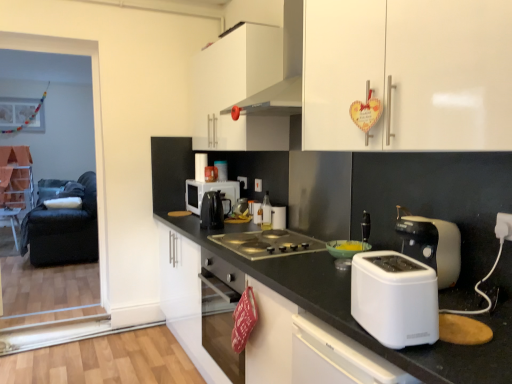
What do you see at coordinates (504, 226) in the screenshot?
I see `white plastic electric outlet at right` at bounding box center [504, 226].

This screenshot has height=384, width=512. Identify the location of white plastic toaster at lower right, the first toaster from the left. (395, 298).

What do you see at coordinates (11, 220) in the screenshot? I see `wooden table at left` at bounding box center [11, 220].

Describe the element at coordinates (209, 190) in the screenshot. I see `black plastic microwave at center` at that location.

The width and height of the screenshot is (512, 384). What are the coordinates of `translucent glass bottle at center, which appears as the third appliance when viewed from the left` in the screenshot? It's located at (266, 212).

Are translucent glass bottle at center, the 3th appliance in the right-to-left sequence, and white glossy cup at center, the 3th appliance when ordered from front to back, far apart?

No, translucent glass bottle at center, the 3th appliance in the right-to-left sequence, is in close proximity to white glossy cup at center, the 3th appliance when ordered from front to back.

Is translucent glass bottle at center, which appears as the third appliance when viewed from the left, to the left of white glossy cup at center, the 3th appliance when ordered from front to back, from the viewer's perspective?

Correct, you'll find translucent glass bottle at center, which appears as the third appliance when viewed from the left, to the left of white glossy cup at center, the 3th appliance when ordered from front to back.

From the image's perspective, between translucent glass bottle at center, the 3th appliance in the right-to-left sequence, and white glossy cup at center, the 3th appliance when ordered from front to back, which one is located above?

translucent glass bottle at center, the 3th appliance in the right-to-left sequence, is shown above in the image.

How much distance is there between translucent glass bottle at center, which appears as the third appliance when viewed from the left, and white glossy cup at center, the 3th appliance viewed from the back?

translucent glass bottle at center, which appears as the third appliance when viewed from the left, is 2.08 inches from white glossy cup at center, the 3th appliance viewed from the back.

Consider the image. Does translucent glass bottle at center, arranged as the 2th appliance when viewed from the front, have a greater width compared to wooden table at left?

No, translucent glass bottle at center, arranged as the 2th appliance when viewed from the front, is not wider than wooden table at left.

Is wooden table at left located within translucent glass bottle at center, which appears as the third appliance when viewed from the left?

Definitely not — wooden table at left is not inside translucent glass bottle at center, which appears as the third appliance when viewed from the left.

Is translucent glass bottle at center, which appears as the third appliance when viewed from the left, looking in the opposite direction of wooden table at left?

No, translucent glass bottle at center, which appears as the third appliance when viewed from the left, is not facing the opposite direction of wooden table at left.

Would you say white plastic electric outlet at right is part of white glossy cup at center, positioned as the second appliance in right-to-left order,'s contents?

That's incorrect, white plastic electric outlet at right is not inside white glossy cup at center, positioned as the second appliance in right-to-left order.

From the image's perspective, is white glossy cup at center, the 3th appliance when ordered from front to back, beneath white plastic electric outlet at right?

Yes, from the image's perspective, white glossy cup at center, the 3th appliance when ordered from front to back, is below white plastic electric outlet at right.

Considering the relative sizes of white glossy cup at center, positioned as the second appliance in right-to-left order, and white plastic electric outlet at right in the image provided, is white glossy cup at center, positioned as the second appliance in right-to-left order, bigger than white plastic electric outlet at right?

Correct, white glossy cup at center, positioned as the second appliance in right-to-left order, is larger in size than white plastic electric outlet at right.

From the picture: Between white glossy cup at center, positioned as the second appliance in right-to-left order, and white plastic electric outlet at right, which one has less height?

white plastic electric outlet at right is shorter.

Is white plastic toaster at lower right, which is the 2th toaster from right to left, situated inside white plastic bowl at center, placed as the fifth appliance when sorted from back to front, or outside?

white plastic toaster at lower right, which is the 2th toaster from right to left, is located beyond the bounds of white plastic bowl at center, placed as the fifth appliance when sorted from back to front.

How many degrees apart are the facing directions of white plastic toaster at lower right, which is the 2th toaster from right to left, and white plastic bowl at center, the first appliance in the right-to-left sequence?

white plastic toaster at lower right, which is the 2th toaster from right to left, and white plastic bowl at center, the first appliance in the right-to-left sequence, are facing 16.5 degrees away from each other.

From the image's perspective, which one is positioned higher, white plastic toaster at lower right, which is the 2th toaster from right to left, or white plastic bowl at center, arranged as the fifth appliance when viewed from the left?

white plastic bowl at center, arranged as the fifth appliance when viewed from the left, appears higher in the image.

Between white plastic toaster at lower right, which is the 2th toaster from right to left, and white plastic bowl at center, placed as the fifth appliance when sorted from back to front, which one has more height?

With more height is white plastic toaster at lower right, which is the 2th toaster from right to left.

Is white glossy countertop at center positioned before white plastic toaster at lower right, the 1th toaster from the front?

No, it is not.

Between white glossy countertop at center and white plastic toaster at lower right, the 1th toaster from the front, which one has smaller width?

white plastic toaster at lower right, the 1th toaster from the front, is thinner.

Is white glossy countertop at center completely or partially outside of white plastic toaster at lower right, the first toaster from the left?

white glossy countertop at center is positioned outside white plastic toaster at lower right, the first toaster from the left.

From the picture: From the image's perspective, which one is positioned higher, metallic gray cooktop at center or black fabric screen door at left?

black fabric screen door at left appears higher in the image.

Considering the sizes of objects metallic gray cooktop at center and black fabric screen door at left in the image provided, who is shorter, metallic gray cooktop at center or black fabric screen door at left?

Standing shorter between the two is metallic gray cooktop at center.

Would you consider metallic gray cooktop at center to be distant from black fabric screen door at left?

Absolutely, metallic gray cooktop at center is distant from black fabric screen door at left.

Could you tell me if metallic gray cooktop at center is facing black fabric screen door at left?

No.

From the image's perspective, between white plastic bowl at center, the first appliance in the right-to-left sequence, and white glossy cabinet at upper center, which is counted as the first cabinetry, starting from the left, who is located below?

white plastic bowl at center, the first appliance in the right-to-left sequence.

Consider the image. Is white plastic bowl at center, arranged as the fifth appliance when viewed from the left, taller or shorter than white glossy cabinet at upper center, which is counted as the first cabinetry, starting from the left?

Clearly, white plastic bowl at center, arranged as the fifth appliance when viewed from the left, is shorter compared to white glossy cabinet at upper center, which is counted as the first cabinetry, starting from the left.

Considering the relative positions of white plastic bowl at center, which ranks as the 1th appliance in front-to-back order, and white glossy cabinet at upper center, the 2th cabinetry from the front, in the image provided, is white plastic bowl at center, which ranks as the 1th appliance in front-to-back order, behind white glossy cabinet at upper center, the 2th cabinetry from the front,?

No, white plastic bowl at center, which ranks as the 1th appliance in front-to-back order, is closer to the viewer.

There is a white plastic bowl at center, arranged as the fifth appliance when viewed from the left. Where is `the 2nd cabinetry above it (from a real-world perspective)`? This screenshot has width=512, height=384. the 2nd cabinetry above it (from a real-world perspective) is located at coordinates (238, 90).

Starting from the white glossy cup at center, marked as the 4th appliance in a left-to-right arrangement, which appliance is the 1st one to the left? Please provide its 2D coordinates.

[(266, 212)]

Identify the location of table below the translucent glass bottle at center, which appears as the third appliance when viewed from the left (from the image's perspective). This screenshot has height=384, width=512. (11, 220).

When comparing their distances from wooden table at left, does white glossy range hood at upper center or white plastic electric outlet at right seem further?

Based on the image, white plastic electric outlet at right appears to be further to wooden table at left.

When comparing their distances from white glossy cabinet at upper center, which is counted as the first cabinetry, starting from the left, does white glossy cup at center, the 3th appliance when ordered from front to back, or translucent glass bottle at center, arranged as the 2th appliance when viewed from the front, seem closer?

Based on the image, translucent glass bottle at center, arranged as the 2th appliance when viewed from the front, appears to be nearer to white glossy cabinet at upper center, which is counted as the first cabinetry, starting from the left.

Based on the photo, looking at the image, which one is located closer to white plastic bowl at center, which ranks as the 1th appliance in front-to-back order, metallic silver kettle at center, which is the 4th appliance from right to left, or white plastic electric outlet at right?

The object closer to white plastic bowl at center, which ranks as the 1th appliance in front-to-back order, is white plastic electric outlet at right.

Looking at the image, which one is located further to translucent glass bottle at center, which appears as the third appliance when viewed from the left, white plastic toaster at lower right, which is the 2th toaster from right to left, or black plastic microwave at center?

white plastic toaster at lower right, which is the 2th toaster from right to left.

When comparing their distances from black plastic tea pot at center, does white plastic toaster at right, the 2th toaster in the front-to-back sequence, or wooden table at left seem further?

wooden table at left is positioned further to the anchor black plastic tea pot at center.

From the image, which object appears to be nearer to wooden table at left, black fabric armchair at left or metallic silver kettle at center, which is the 4th appliance from right to left?

Among the two, black fabric armchair at left is located nearer to wooden table at left.

From the image, which object appears to be nearer to translucent glass bottle at center, the 3th appliance in the right-to-left sequence, metallic silver kettle at center, which is the second appliance in back-to-front order, or white glossy cabinet at upper center, which appears as the first cabinetry when viewed from the front?

Among the two, metallic silver kettle at center, which is the second appliance in back-to-front order, is located nearer to translucent glass bottle at center, the 3th appliance in the right-to-left sequence.

When comparing their distances from black fabric screen door at left, does white plastic electric outlet at right or white glossy cup at center, marked as the 4th appliance in a left-to-right arrangement, seem further?

white plastic electric outlet at right is positioned further to the anchor black fabric screen door at left.

Locate an element on the screen. The height and width of the screenshot is (384, 512). countertop between white plastic toaster at lower right, the 1th toaster from the front, and metallic gray cooktop at center, along the z-axis is located at coordinates pos(354,319).

You are a GUI agent. You are given a task and a screenshot of the screen. Output one action in this format:
    pyautogui.click(x=<x>, y=<y>)
    Task: Click on the home appliance positioned between white plastic electric outlet at right and white glossy cabinet at upper center, which is counted as the first cabinetry, starting from the left, from near to far
    The height and width of the screenshot is (384, 512).
    Given the screenshot: What is the action you would take?
    pyautogui.click(x=284, y=69)

In order to click on gas stove between black fabric screen door at left and white plastic toaster at lower right, placed as the 2th toaster when sorted from back to front in this screenshot , I will do `click(267, 243)`.

At what (x,y) coordinates should I click in order to perform the action: click on gas stove positioned between white plastic toaster at lower right, the 1th toaster from the front, and metallic silver kettle at center, which ranks as the fourth appliance in front-to-back order, from near to far. Please return your answer as a coordinate pair (x, y). This screenshot has width=512, height=384. Looking at the image, I should click on (267, 243).